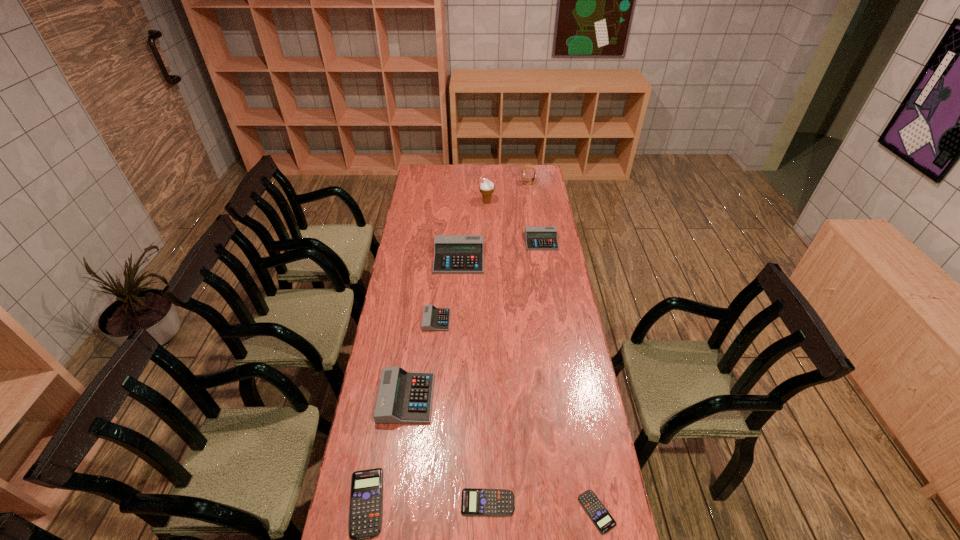
What are the coordinates of `vacant space that's between the rightmost gray calculator and the shortest object` in the screenshot? It's located at (569, 376).

This screenshot has height=540, width=960. In order to click on free space between the third tallest calculator and the rightmost blue calculator in this screenshot , I will do `click(569, 376)`.

The width and height of the screenshot is (960, 540). Find the location of `empty space between the biggest gray calculator and the second smallest blue calculator`. empty space between the biggest gray calculator and the second smallest blue calculator is located at coordinates (473, 380).

The height and width of the screenshot is (540, 960). In order to click on blank region between the sixth tallest calculator and the third biggest gray calculator in this screenshot , I will do `click(515, 372)`.

I want to click on object identified as the eighth closest to the rightmost blue calculator, so click(525, 167).

Find the location of a particular element. object that stands as the sixth closest to the rightmost blue calculator is located at coordinates (537, 237).

Image resolution: width=960 pixels, height=540 pixels. I want to click on the second closest calculator to the eighth shortest object, so click(453, 254).

Where is `the closest calculator to the second blue calculator from right to left`? This screenshot has height=540, width=960. the closest calculator to the second blue calculator from right to left is located at coordinates (597, 512).

Where is `gray calculator that stands as the third closest to the eighth tallest object`? gray calculator that stands as the third closest to the eighth tallest object is located at coordinates (453, 254).

Choose which gray calculator is the nearest neighbor to the fifth nearest calculator. Please provide its 2D coordinates. Your answer should be formatted as a tuple, i.e. [(x, y)], where the tuple contains the x and y coordinates of a point satisfying the conditions above.

[(403, 397)]